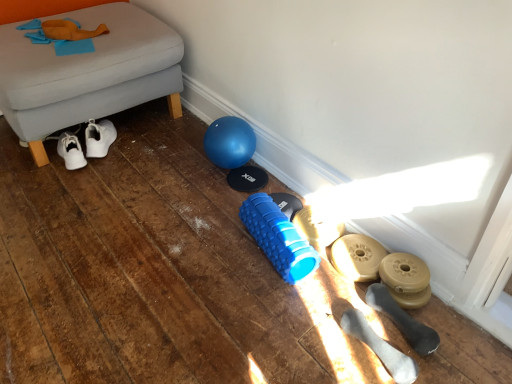
Question: Is black rubber dumbbell at lower right, which is the second footwear in front-to-back order, beside blue rubber shoe at center, the fifth footwear positioned from the front?

Choices:
 (A) yes
 (B) no

Answer: (B)

Question: Is black rubber dumbbell at lower right, which is the second footwear in front-to-back order, outside blue rubber shoe at center, placed as the 1th footwear when sorted from back to front?

Choices:
 (A) yes
 (B) no

Answer: (A)

Question: From the image's perspective, does black rubber dumbbell at lower right, which is counted as the 4th footwear, starting from the back, appear lower than blue rubber shoe at center, placed as the 1th footwear when sorted from back to front?

Choices:
 (A) yes
 (B) no

Answer: (A)

Question: From a real-world perspective, is black rubber dumbbell at lower right, which is the second footwear in front-to-back order, on top of blue rubber shoe at center, the fifth footwear positioned from the front?

Choices:
 (A) no
 (B) yes

Answer: (A)

Question: From a real-world perspective, is black rubber dumbbell at lower right, which is the second footwear in front-to-back order, located beneath blue rubber shoe at center, placed as the 1th footwear when sorted from back to front?

Choices:
 (A) no
 (B) yes

Answer: (B)

Question: In terms of height, does gray fabric ottoman at lower left look taller or shorter compared to blue rubber shoe at center, placed as the 1th footwear when sorted from back to front?

Choices:
 (A) tall
 (B) short

Answer: (A)

Question: Considering the positions of point (95, 91) and point (294, 225), is point (95, 91) closer or farther from the camera than point (294, 225)?

Choices:
 (A) farther
 (B) closer

Answer: (A)

Question: Do you think gray fabric ottoman at lower left is within blue rubber shoe at center, the fifth footwear positioned from the front, or outside of it?

Choices:
 (A) outside
 (B) inside

Answer: (A)

Question: Visually, is gray fabric ottoman at lower left positioned to the left or to the right of blue rubber shoe at center, placed as the 1th footwear when sorted from back to front?

Choices:
 (A) right
 (B) left

Answer: (B)

Question: Considering the positions of blue rubber shoe at center, placed as the 1th footwear when sorted from back to front, and white rubber dumbbells at lower right, the 1th footwear in the front-to-back sequence, in the image, is blue rubber shoe at center, placed as the 1th footwear when sorted from back to front, bigger or smaller than white rubber dumbbells at lower right, the 1th footwear in the front-to-back sequence,?

Choices:
 (A) small
 (B) big

Answer: (A)

Question: Visually, is blue rubber shoe at center, the fifth footwear positioned from the front, positioned to the left or to the right of white rubber dumbbells at lower right, which is the 5th footwear from back to front?

Choices:
 (A) left
 (B) right

Answer: (A)

Question: Relative to white rubber dumbbells at lower right, which is the 5th footwear from back to front, is blue rubber shoe at center, the fifth footwear positioned from the front, in front or behind?

Choices:
 (A) behind
 (B) front

Answer: (A)

Question: In terms of width, does blue rubber shoe at center, placed as the 1th footwear when sorted from back to front, look wider or thinner when compared to white rubber dumbbells at lower right, the 1th footwear in the front-to-back sequence?

Choices:
 (A) wide
 (B) thin

Answer: (A)

Question: Based on their positions, is white rubber dumbbells at lower right, which is the 5th footwear from back to front, located to the left or right of blue rubber foam roller at center?

Choices:
 (A) right
 (B) left

Answer: (A)

Question: Considering the positions of white rubber dumbbells at lower right, which is the 5th footwear from back to front, and blue rubber foam roller at center in the image, is white rubber dumbbells at lower right, which is the 5th footwear from back to front, wider or thinner than blue rubber foam roller at center?

Choices:
 (A) wide
 (B) thin

Answer: (B)